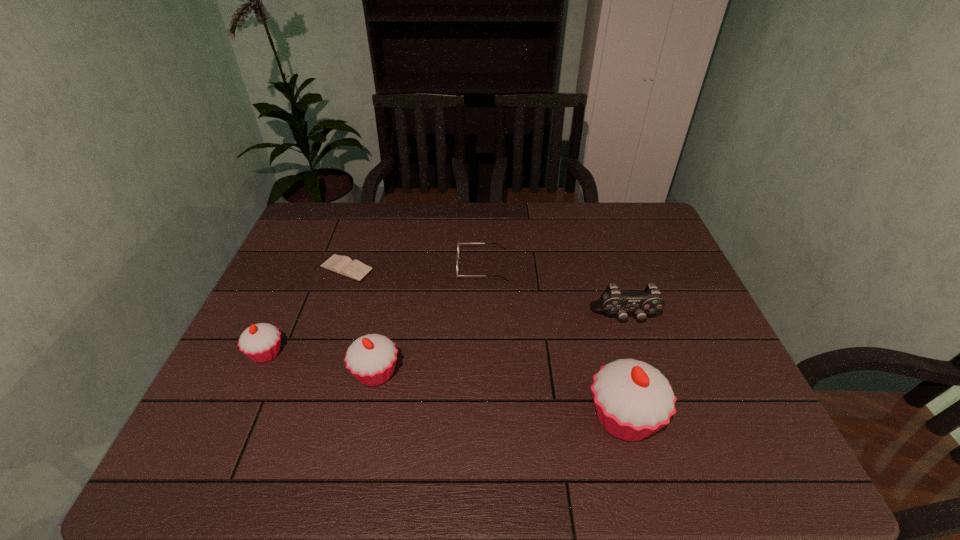
You are a GUI agent. You are given a task and a screenshot of the screen. Output one action in this format:
    pyautogui.click(x=<x>, y=<y>)
    Task: Click on the leftmost cupcake
    The width and height of the screenshot is (960, 540).
    Given the screenshot: What is the action you would take?
    pyautogui.click(x=260, y=342)

Image resolution: width=960 pixels, height=540 pixels. Identify the location of the second tallest cupcake. (371, 359).

You are a GUI agent. You are given a task and a screenshot of the screen. Output one action in this format:
    pyautogui.click(x=<x>, y=<y>)
    Task: Click on the second cupcake from right to left
    Image resolution: width=960 pixels, height=540 pixels.
    Given the screenshot: What is the action you would take?
    pyautogui.click(x=371, y=359)

I want to click on the rightmost cupcake, so click(x=633, y=400).

I want to click on the tallest cupcake, so click(633, 400).

The width and height of the screenshot is (960, 540). I want to click on the fourth nearest object, so click(613, 301).

Where is `the fifth tallest object`? This screenshot has height=540, width=960. the fifth tallest object is located at coordinates 458,242.

This screenshot has height=540, width=960. I want to click on spectacles, so click(x=458, y=242).

Locate an element on the screen. the shortest object is located at coordinates (x=343, y=265).

Identify the location of free space located 0.250m on the right of the leftmost cupcake. Image resolution: width=960 pixels, height=540 pixels. [386, 353].